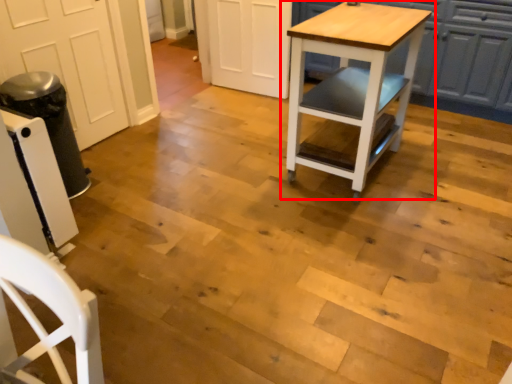
Question: Where is table (annotated by the red box) located in relation to cabinetry in the image?

Choices:
 (A) right
 (B) left

Answer: (B)